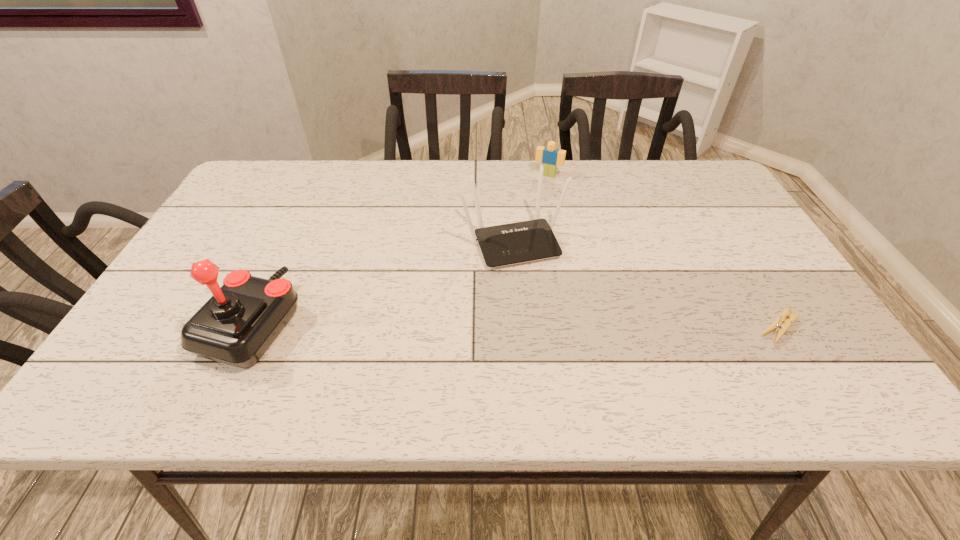
You are a GUI agent. You are given a task and a screenshot of the screen. Output one action in this format:
    pyautogui.click(x=<x>, y=<y>)
    Task: Click on the vacant point located between the tallest object and the second shortest object
    The height and width of the screenshot is (540, 960).
    Given the screenshot: What is the action you would take?
    pyautogui.click(x=400, y=249)

What are the coordinates of `free spot between the farthest object and the second farthest object` in the screenshot? It's located at (531, 208).

This screenshot has width=960, height=540. I want to click on vacant area that lies between the third tallest object and the tallest object, so 400,249.

The image size is (960, 540). Find the location of `unoccupied area between the joystick and the rightmost object`. unoccupied area between the joystick and the rightmost object is located at coordinates (516, 325).

You are a GUI agent. You are given a task and a screenshot of the screen. Output one action in this format:
    pyautogui.click(x=<x>, y=<y>)
    Task: Click on the empty space between the second tallest object and the rightmost object
    The image size is (960, 540).
    Given the screenshot: What is the action you would take?
    pyautogui.click(x=646, y=285)

Image resolution: width=960 pixels, height=540 pixels. What are the coordinates of `free space between the Lego and the joystick` in the screenshot? It's located at (400, 249).

Find the location of a particular element. The width and height of the screenshot is (960, 540). vacant space in between the tallest object and the third shortest object is located at coordinates (383, 282).

Find the location of a particular element. vacant space that is in between the joystick and the shortest object is located at coordinates (516, 325).

At what (x,y) coordinates should I click in order to perform the action: click on object that can be found as the second closest to the third tallest object. Please return your answer as a coordinate pair (x, y). The height and width of the screenshot is (540, 960). Looking at the image, I should click on (776, 326).

Locate which object ranks second in proximity to the rightmost object. Please provide its 2D coordinates. Your answer should be formatted as a tuple, i.e. [(x, y)], where the tuple contains the x and y coordinates of a point satisfying the conditions above.

[(550, 157)]